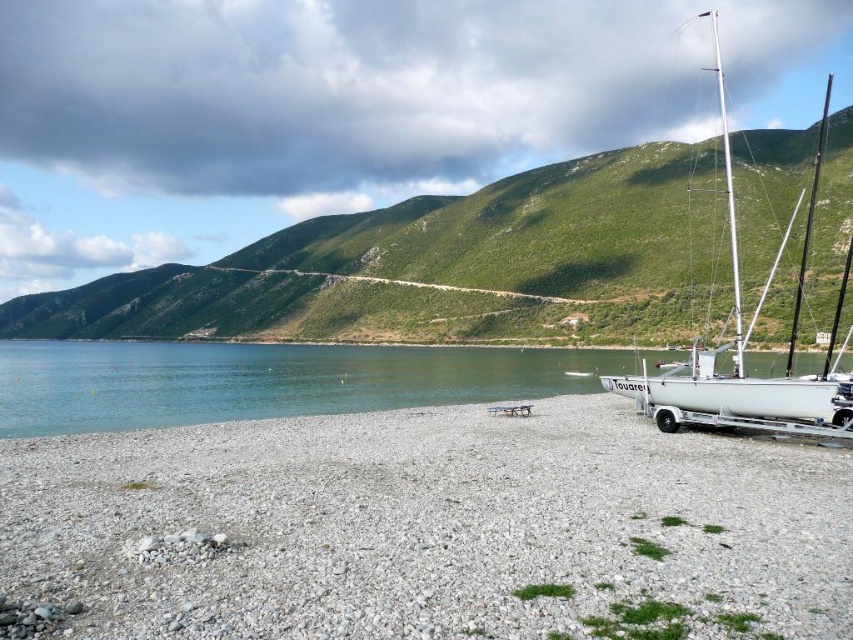
You are a photographer standing on the beach and want to take a picture of the white glossy sailboat at right. To ensure the gray gravelly sand at lower left is visible in the frame, where should you position yourself relative to the sailboat?

You should position yourself to the left of the white glossy sailboat at right so that the gray gravelly sand at lower left is visible below it in the frame.

You are standing at the edge of the pebble beach and want to walk towards the white sailboat named Touareg. There are two points marked on the path you need to cross. The first point is at coordinate point(717, 630) and the second point is at coordinate point(698, 420). Which point will you reach first while walking towards the sailboat?

Point(717, 630) is in front of point(698, 420), so you will reach point(717, 630) first while walking towards the sailboat.